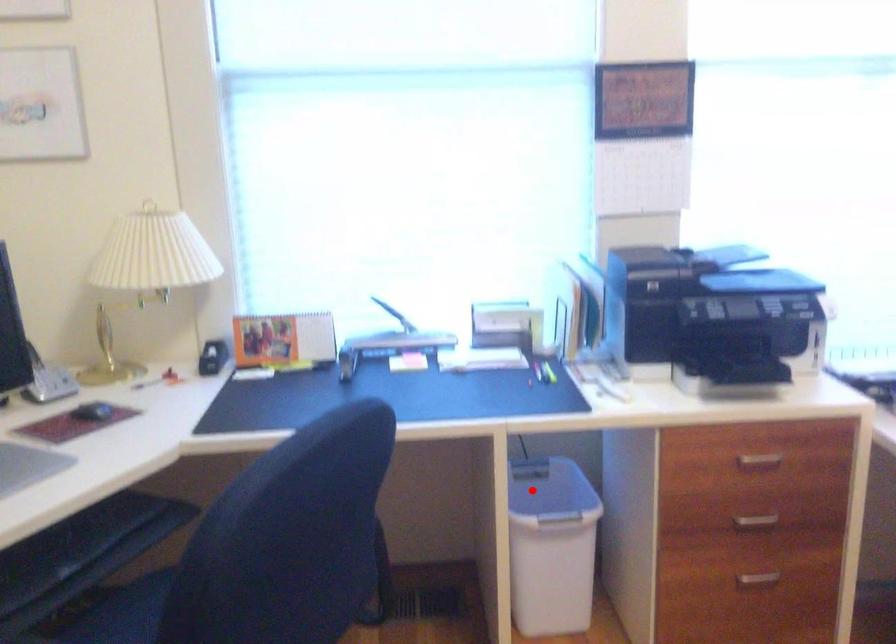
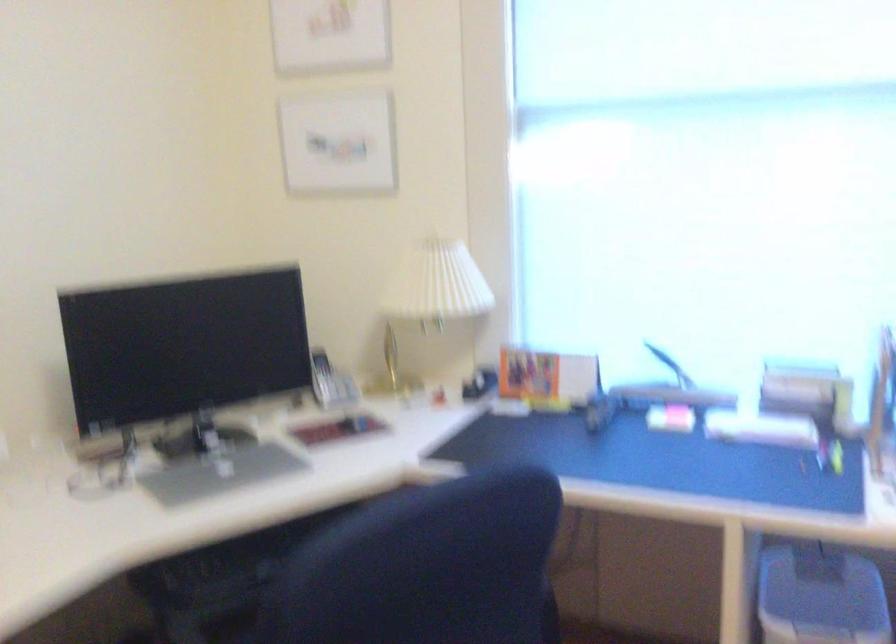
Locate, in the second image, the point that corresponds to the highlighted location in the first image.

(821, 596)